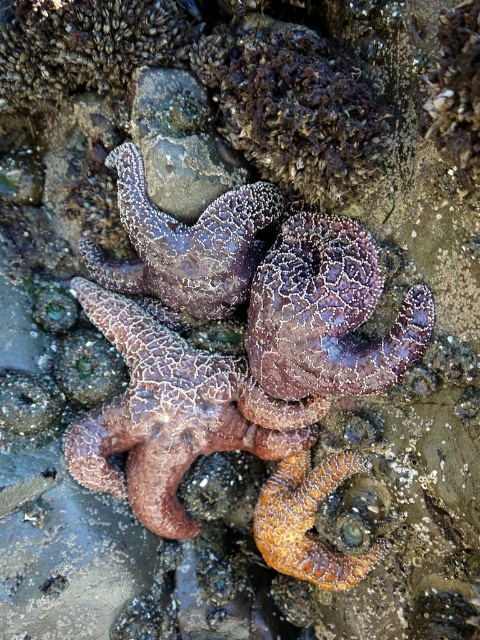
You are a marine biologist examining the rocky shoreline. You need to determine which of the two starfish, the rusty textured starfish at center or the purple rough starfish at center, is smaller in width. Which one should you measure first to confirm?

The rusty textured starfish at center has a lesser width compared to the purple rough starfish at center, so you should measure the rusty textured starfish at center first to confirm its smaller size.

You are a marine biologist examining a tidal pool. You notice a rusty textured starfish at center. Can you determine its exact position in the tidal pool using the coordinate system provided?

The rusty textured starfish at center is located at point coordinates (326,314).